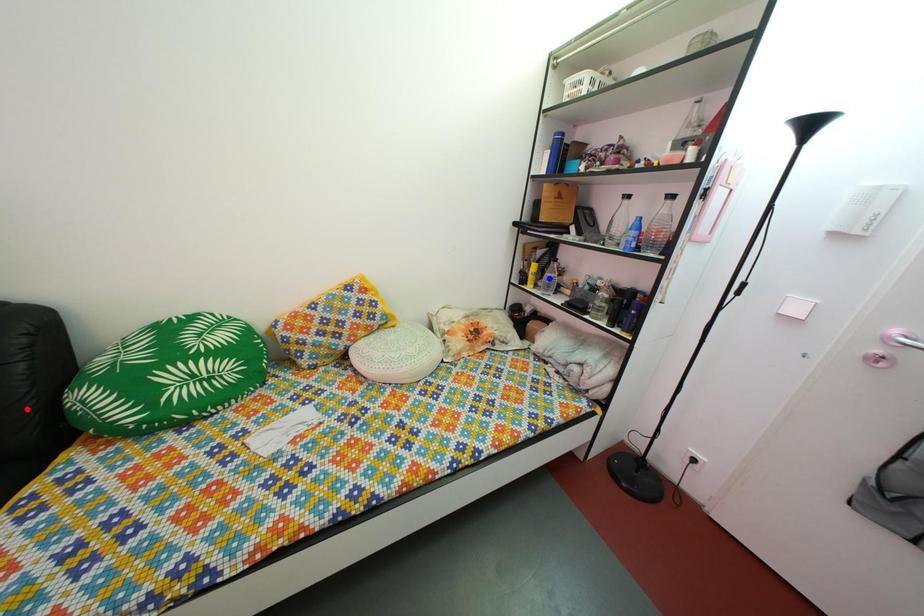
Question: In the image, two points are highlighted. Which point is nearer to the camera? Reply with the corresponding letter.

Choices:
 (A) blue point
 (B) red point

Answer: (B)